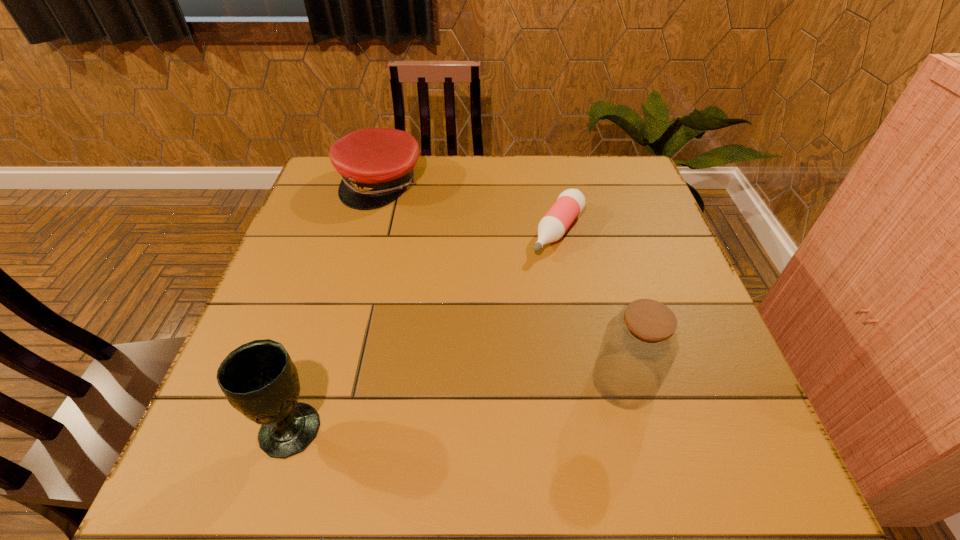
This screenshot has width=960, height=540. I want to click on object at the near right corner, so click(640, 344).

Where is `vacant area at the far edge of the desktop`? vacant area at the far edge of the desktop is located at coordinates (496, 172).

Where is `vacant area at the near edge`? Image resolution: width=960 pixels, height=540 pixels. vacant area at the near edge is located at coordinates (429, 403).

You are a GUI agent. You are given a task and a screenshot of the screen. Output one action in this format:
    pyautogui.click(x=<x>, y=<y>)
    Task: Click on the vacant space at the left edge
    The height and width of the screenshot is (540, 960).
    Given the screenshot: What is the action you would take?
    pyautogui.click(x=332, y=226)

The image size is (960, 540). What are the coordinates of `free space at the near right corner of the desktop` in the screenshot? It's located at (684, 399).

What are the coordinates of `empty space between the jar and the shortest object` in the screenshot? It's located at (591, 306).

This screenshot has width=960, height=540. What are the coordinates of `vacant area between the jar and the chalice` in the screenshot? It's located at (457, 404).

This screenshot has height=540, width=960. What are the coordinates of `vacant point located between the third tallest object and the jar` in the screenshot? It's located at (502, 282).

The width and height of the screenshot is (960, 540). I want to click on vacant point located between the cap and the jar, so click(x=502, y=282).

In order to click on empty location between the shortest object and the second shortest object in this screenshot , I will do `click(469, 207)`.